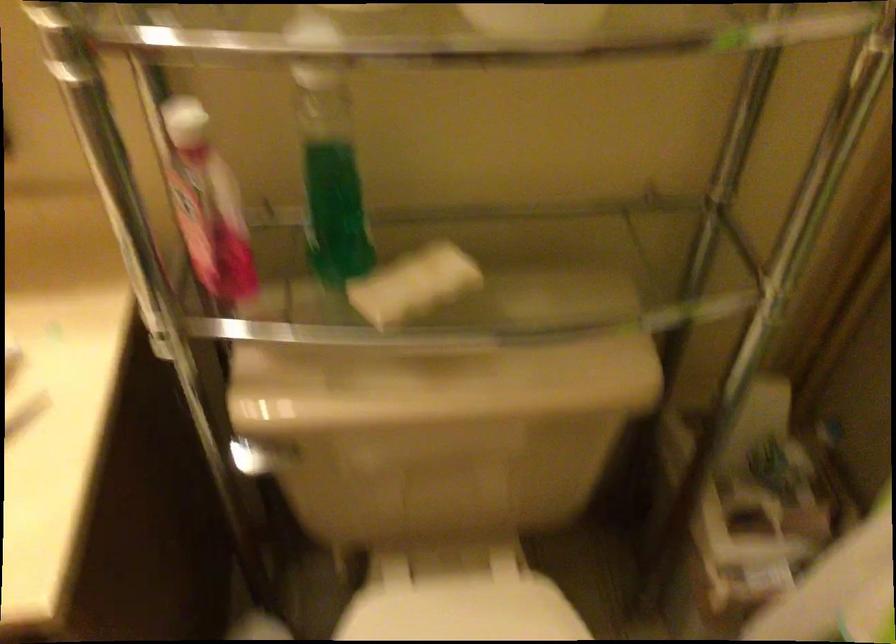
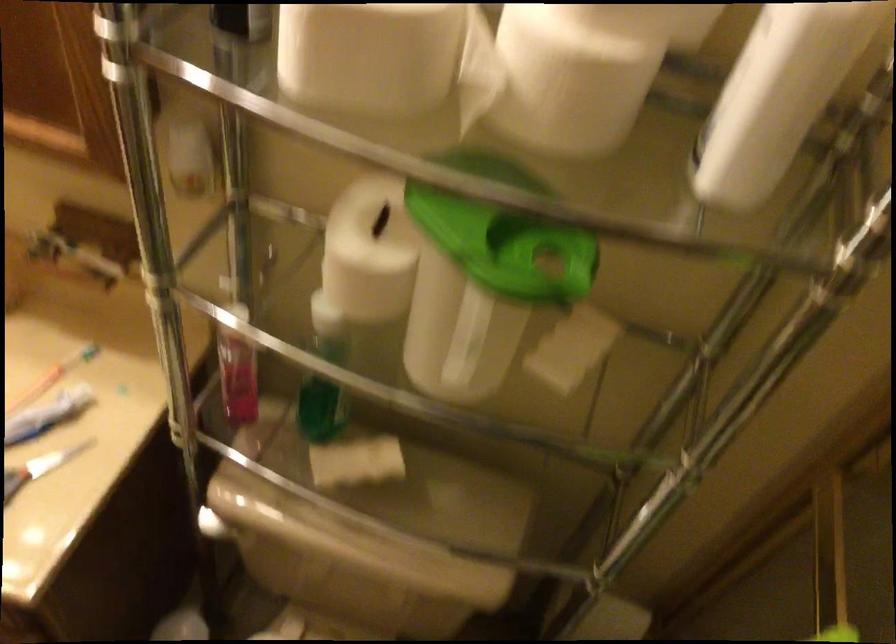
Looking at this image, in a continuous first-person perspective shot, in which direction is the camera moving?

The movement direction of the cameraman is right, backward.